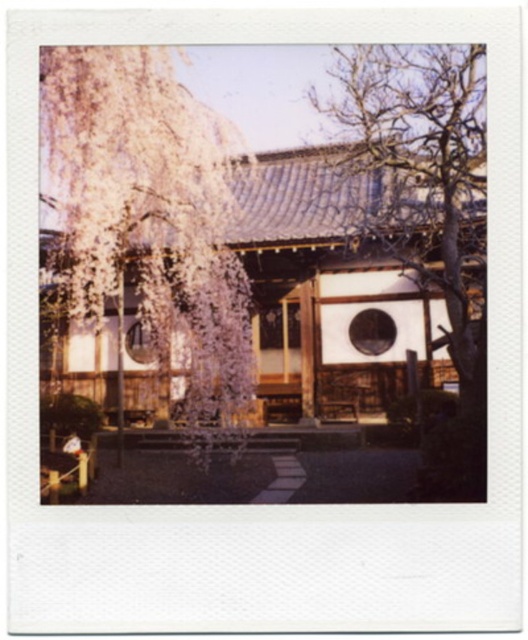
Looking at this image, you are a visitor standing in front of the traditional Japanese building. You notice the white silky tree at upper left and the bare wood tree at right. Which tree is positioned more to the left side of the scene?

The white silky tree at upper left is positioned more to the left side of the scene than the bare wood tree at right.

You are a photographer planning to take a picture of the white silky tree at upper left and the bare wood tree at right. The minimum distance between the trees required for your camera lens to focus on both is 4 meters. Can you capture both trees in focus with your current setup?

The white silky tree at upper left and the bare wood tree at right are 3.82 meters apart from each other. Since this distance is less than the required 4 meters, your camera lens cannot focus on both trees simultaneously with the current setup.

You are standing in front of the traditional Japanese building with the weeping cherry tree nearby. Where is the white silky tree at upper left positioned relative to the building?

The white silky tree at upper left is positioned at coordinates point (150, 216), which places it near the upper left area of the scene, likely above and to the left of the building.